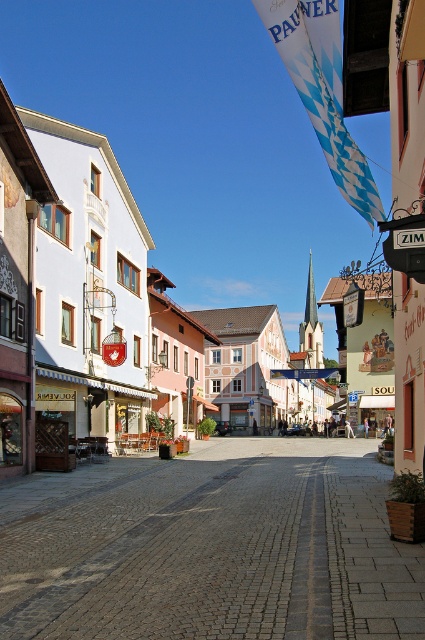
Which is below, cobblestone street at center or white painted building at left?

cobblestone street at center

Can you confirm if cobblestone street at center is thinner than white painted building at left?

Correct, cobblestone street at center's width is less than white painted building at left's.

This screenshot has width=425, height=640. Find the location of `cobblestone street at center`. cobblestone street at center is located at coordinates (210, 547).